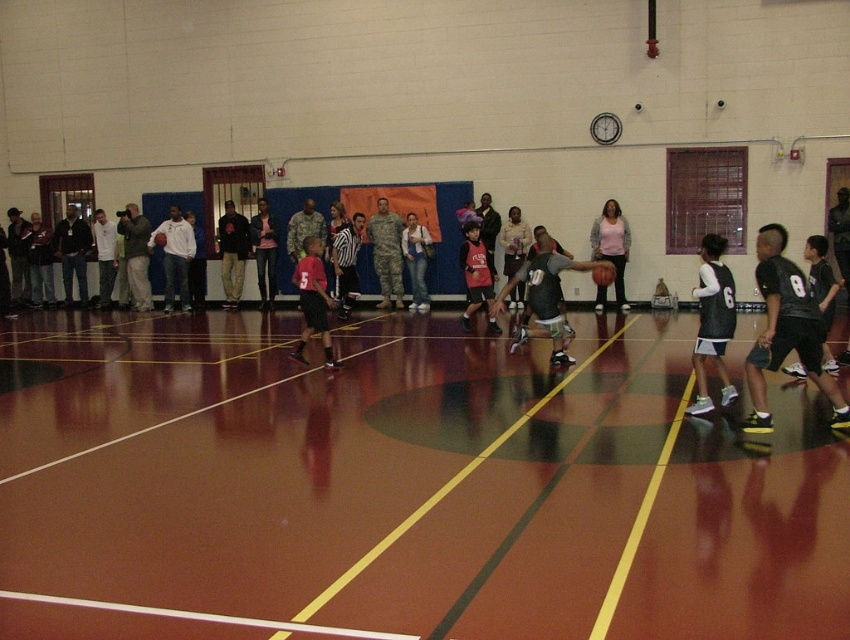
Measure the distance between matte pink sweater at center and camera.

A distance of 18.30 meters exists between matte pink sweater at center and camera.

Is matte pink sweater at center to the left of denim jacket at center from the viewer's perspective?

Incorrect, matte pink sweater at center is not on the left side of denim jacket at center.

Which is in front, point (602, 289) or point (414, 227)?

Point (602, 289) is in front.

Identify the location of matte pink sweater at center. The height and width of the screenshot is (640, 850). (612, 244).

Who is shorter, matte pink sweater at center or shiny orange basketball at center?

With less height is shiny orange basketball at center.

Does point (612, 260) come farther from viewer compared to point (163, 244)?

That is False.

Locate an element on the screen. matte pink sweater at center is located at coordinates (612, 244).

Between denim jacket at center and rubber textured basketball at center, which one is positioned lower?

rubber textured basketball at center

The height and width of the screenshot is (640, 850). Describe the element at coordinates (416, 260) in the screenshot. I see `denim jacket at center` at that location.

Who is more distant from viewer, [421,259] or [608,266]?

The point [421,259] is behind.

This screenshot has height=640, width=850. What are the coordinates of `denim jacket at center` in the screenshot? It's located at (416, 260).